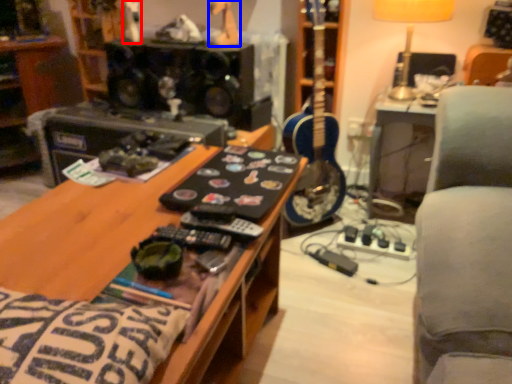
Question: Among these objects, which one is nearest to the camera, toy (highlighted by a red box) or toy (highlighted by a blue box)?

Choices:
 (A) toy
 (B) toy

Answer: (B)